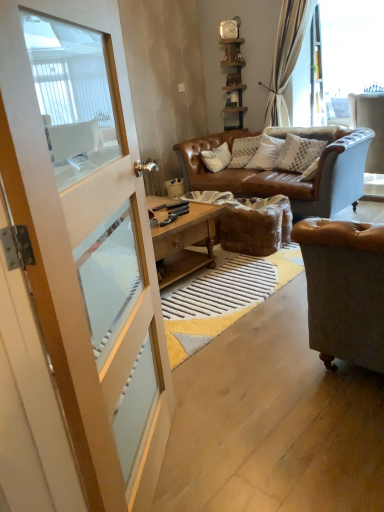
The height and width of the screenshot is (512, 384). What are the coordinates of `free space behind white wood screen door at left` in the screenshot? It's located at (203, 390).